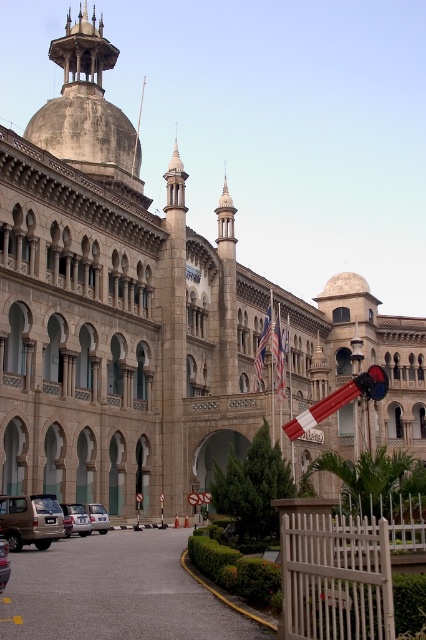
Is gold metallic suv at lower left below blue fabric flag at center?

Yes.

Is gold metallic suv at lower left behind blue fabric flag at center?

No.

Does point (0, 508) lie in front of point (279, 385)?

Yes, point (0, 508) is closer to viewer.

You are a GUI agent. You are given a task and a screenshot of the screen. Output one action in this format:
    pyautogui.click(x=<x>, y=<y>)
    Task: Click on the gold metallic suv at lower left
    This screenshot has width=426, height=640.
    Given the screenshot: What is the action you would take?
    pyautogui.click(x=31, y=520)

Who is taller, blue fabric flag at center or silver metallic car at lower left?

blue fabric flag at center

Find the location of a particular element. blue fabric flag at center is located at coordinates (279, 356).

Find the location of a particular element. Image resolution: width=426 pixels, height=640 pixels. blue fabric flag at center is located at coordinates (279, 356).

Which of these two, blue fabric flag at center or silver metallic car at center, stands shorter?

silver metallic car at center is shorter.

Who is more distant from viewer, (284, 388) or (94, 518)?

The point (284, 388) is behind.

Measure the distance between blue fabric flag at center and camera.

The distance of blue fabric flag at center from camera is 67.77 meters.

The image size is (426, 640). I want to click on blue fabric flag at center, so click(x=279, y=356).